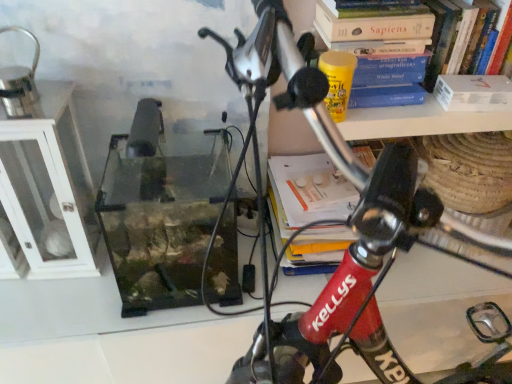
At what (x,y) coordinates should I click in order to perform the action: click on free space above hardcover book at upper right, positioned as the 2th book in right-to-left order (from a real-world perspective). Please return your answer as a coordinate pair (x, y). The width and height of the screenshot is (512, 384). Looking at the image, I should click on (395, 4).